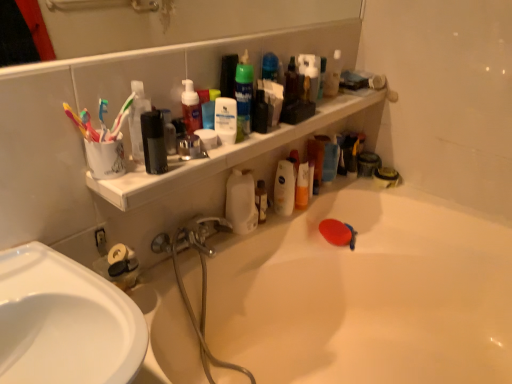
Question: Is matte red soap dispenser at upper center, which is the fifth cleaning product from right to left, not within translucent plastic toothbrush at upper left, the first toothbrush in the right-to-left sequence?

Choices:
 (A) no
 (B) yes

Answer: (B)

Question: Is the position of matte red soap dispenser at upper center, the 1th cleaning product positioned from the left, more distant than that of translucent plastic toothbrush at upper left, the first toothbrush in the right-to-left sequence?

Choices:
 (A) yes
 (B) no

Answer: (A)

Question: Can you confirm if matte red soap dispenser at upper center, which is the fifth cleaning product from right to left, is thinner than translucent plastic toothbrush at upper left, positioned as the 2th toothbrush in left-to-right order?

Choices:
 (A) yes
 (B) no

Answer: (B)

Question: From the image's perspective, does matte red soap dispenser at upper center, which is the fifth cleaning product from right to left, appear lower than translucent plastic toothbrush at upper left, positioned as the 2th toothbrush in left-to-right order?

Choices:
 (A) no
 (B) yes

Answer: (A)

Question: Is matte red soap dispenser at upper center, which is the fifth cleaning product from right to left, smaller than translucent plastic toothbrush at upper left, the first toothbrush in the right-to-left sequence?

Choices:
 (A) no
 (B) yes

Answer: (A)

Question: Looking at the image, does white matte lotion at center, the fourth cleaning product when ordered from right to left, seem bigger or smaller compared to matte red soap dispenser at upper center, which is the fifth cleaning product from right to left?

Choices:
 (A) big
 (B) small

Answer: (B)

Question: From a real-world perspective, is white matte lotion at center, the fourth cleaning product when ordered from right to left, positioned above or below matte red soap dispenser at upper center, which is the fifth cleaning product from right to left?

Choices:
 (A) below
 (B) above

Answer: (A)

Question: Considering the positions of white matte lotion at center, positioned as the fourth cleaning product in back-to-front order, and matte red soap dispenser at upper center, which is the first cleaning product in front-to-back order, in the image, is white matte lotion at center, positioned as the fourth cleaning product in back-to-front order, wider or thinner than matte red soap dispenser at upper center, which is the first cleaning product in front-to-back order,?

Choices:
 (A) wide
 (B) thin

Answer: (B)

Question: Which is correct: white matte lotion at center, acting as the second cleaning product starting from the front, is inside matte red soap dispenser at upper center, which is the first cleaning product in front-to-back order, or outside of it?

Choices:
 (A) outside
 (B) inside

Answer: (A)

Question: Relative to white matte bottle at center, which ranks as the third cleaning product in left-to-right order, is translucent plastic spray bottle at upper center, which appears as the 1th cleaning product when viewed from the right, in front or behind?

Choices:
 (A) behind
 (B) front

Answer: (A)

Question: Is translucent plastic spray bottle at upper center, placed as the 5th cleaning product when sorted from left to right, wider or thinner than white matte bottle at center, which ranks as the 2th cleaning product in back-to-front order?

Choices:
 (A) wide
 (B) thin

Answer: (B)

Question: Is point (339, 56) closer or farther from the camera than point (245, 195)?

Choices:
 (A) closer
 (B) farther

Answer: (B)

Question: From their relative heights in the image, would you say translucent plastic spray bottle at upper center, the 5th cleaning product when ordered from front to back, is taller or shorter than white matte bottle at center, placed as the 4th cleaning product when sorted from front to back?

Choices:
 (A) short
 (B) tall

Answer: (A)

Question: From a real-world perspective, is white glossy bathtub at upper center above or below multicolored plastic toothbrushes at left, the 2th toothbrush from the right?

Choices:
 (A) below
 (B) above

Answer: (A)

Question: Is white glossy bathtub at upper center bigger or smaller than multicolored plastic toothbrushes at left, the 2th toothbrush from the right?

Choices:
 (A) big
 (B) small

Answer: (A)